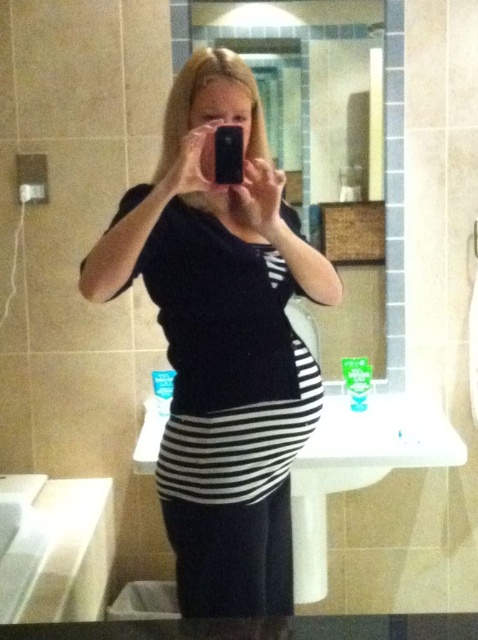
Does black striped shirt at center have a greater width compared to glossy plastic mirror at upper center?

No.

Does point (182, 365) come in front of point (327, 369)?

That is True.

This screenshot has width=478, height=640. In order to click on black striped shirt at center in this screenshot , I will do `click(221, 340)`.